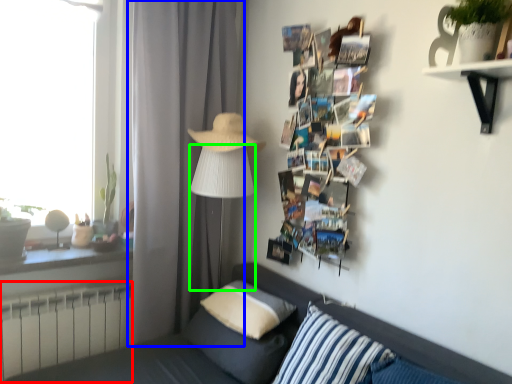
Question: Based on their relative distances, which object is nearer to radiator (highlighted by a red box)? Choose from curtain (highlighted by a blue box) and table lamp (highlighted by a green box).

Choices:
 (A) curtain
 (B) table lamp

Answer: (A)